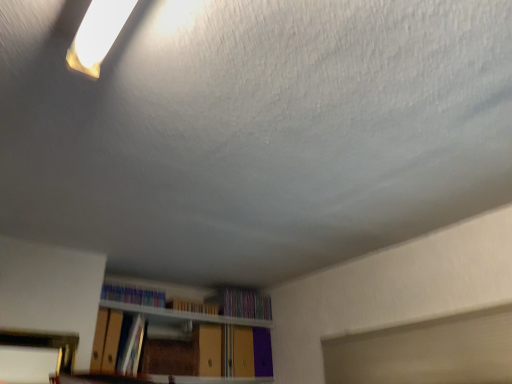
The height and width of the screenshot is (384, 512). What do you see at coordinates (192, 306) in the screenshot?
I see `hardcover book at center, the second book from the right` at bounding box center [192, 306].

In order to click on multicolored plastic books at upper center, which is the first book in left-to-right order in this screenshot , I will do tap(133, 295).

Identify the location of multicolored paper at center, which appears as the fourth book when viewed from the left. The image size is (512, 384). (242, 303).

Is point (135, 352) positioned after point (245, 303)?

No, it is in front of (245, 303).

Is hardcover book at center, which is the second book from left to right, oriented towards multicolored paper at center, marked as the 1th book in a right-to-left arrangement?

No.

How different are the orientations of hardcover book at center, which ranks as the 3th book in right-to-left order, and multicolored paper at center, which appears as the fourth book when viewed from the left, in degrees?

hardcover book at center, which ranks as the 3th book in right-to-left order, and multicolored paper at center, which appears as the fourth book when viewed from the left, are facing 0.0986 degrees away from each other.

Which object is wider, hardcover book at center, which is the second book from left to right, or multicolored paper at center, which appears as the fourth book when viewed from the left?

multicolored paper at center, which appears as the fourth book when viewed from the left.

Would you say multicolored plastic books at upper center, which is the first book in left-to-right order, is part of multicolored paper at center, marked as the 1th book in a right-to-left arrangement,'s contents?

No, multicolored plastic books at upper center, which is the first book in left-to-right order, is located outside of multicolored paper at center, marked as the 1th book in a right-to-left arrangement.

Visually, is multicolored paper at center, marked as the 1th book in a right-to-left arrangement, positioned to the left or to the right of multicolored plastic books at upper center, which is the first book in left-to-right order?

multicolored paper at center, marked as the 1th book in a right-to-left arrangement, is positioned on multicolored plastic books at upper center, which is the first book in left-to-right order,'s right side.

From the picture: Between multicolored paper at center, marked as the 1th book in a right-to-left arrangement, and multicolored plastic books at upper center, which is the first book in left-to-right order, which one has more height?

With more height is multicolored paper at center, marked as the 1th book in a right-to-left arrangement.

Locate an element on the screen. This screenshot has height=384, width=512. the 2nd book behind the multicolored plastic books at upper center, which appears as the fourth book when viewed from the right, counting from the anchor's position is located at coordinates (242, 303).

Which of these two, multicolored paper at center, marked as the 1th book in a right-to-left arrangement, or hardcover book at center, the second book from the right, is smaller?

With smaller size is hardcover book at center, the second book from the right.

Is multicolored paper at center, which appears as the fourth book when viewed from the left, facing away from hardcover book at center, which is the 3th book from left to right?

No.

Can you tell me how much multicolored paper at center, marked as the 1th book in a right-to-left arrangement, and hardcover book at center, which is the 3th book from left to right, differ in facing direction?

The facing directions of multicolored paper at center, marked as the 1th book in a right-to-left arrangement, and hardcover book at center, which is the 3th book from left to right, are 0.63 degrees apart.

Considering the relative sizes of multicolored paper at center, marked as the 1th book in a right-to-left arrangement, and hardcover book at center, which is the 3th book from left to right, in the image provided, is multicolored paper at center, marked as the 1th book in a right-to-left arrangement, wider than hardcover book at center, which is the 3th book from left to right,?

Yes.

Is hardcover book at center, which ranks as the 3th book in right-to-left order, far from multicolored plastic books at upper center, which is the first book in left-to-right order?

hardcover book at center, which ranks as the 3th book in right-to-left order, is actually quite close to multicolored plastic books at upper center, which is the first book in left-to-right order.

Can you tell me how much hardcover book at center, which is the second book from left to right, and multicolored plastic books at upper center, which appears as the fourth book when viewed from the right, differ in facing direction?

hardcover book at center, which is the second book from left to right, and multicolored plastic books at upper center, which appears as the fourth book when viewed from the right, are facing 4.84 degrees away from each other.

Which is more to the left, hardcover book at center, which ranks as the 3th book in right-to-left order, or multicolored plastic books at upper center, which appears as the fourth book when viewed from the right?

multicolored plastic books at upper center, which appears as the fourth book when viewed from the right, is more to the left.

From the image's perspective, relative to multicolored plastic books at upper center, which appears as the fourth book when viewed from the right, is hardcover book at center, which is the second book from left to right, above or below?

From the image's perspective, hardcover book at center, which is the second book from left to right, appears below multicolored plastic books at upper center, which appears as the fourth book when viewed from the right.

From a real-world perspective, relative to hardcover book at center, which is the second book from left to right, is hardcover book at center, the second book from the right, vertically above or below?

Clearly, from a real-world perspective, hardcover book at center, the second book from the right, is above hardcover book at center, which is the second book from left to right.

Considering the relative sizes of hardcover book at center, the second book from the right, and hardcover book at center, which is the second book from left to right, in the image provided, is hardcover book at center, the second book from the right, thinner than hardcover book at center, which is the second book from left to right,?

Yes, hardcover book at center, the second book from the right, is thinner than hardcover book at center, which is the second book from left to right.

Does hardcover book at center, which is the 3th book from left to right, have a smaller size compared to hardcover book at center, which is the second book from left to right?

Yes, hardcover book at center, which is the 3th book from left to right, is smaller than hardcover book at center, which is the second book from left to right.

Relative to hardcover book at center, which is the second book from left to right, is hardcover book at center, which is the 3th book from left to right, in front or behind?

In the image, hardcover book at center, which is the 3th book from left to right, appears behind hardcover book at center, which is the second book from left to right.

Between multicolored paper at center, which appears as the fourth book when viewed from the left, and hardcover book at center, which ranks as the 3th book in right-to-left order, which one appears on the right side from the viewer's perspective?

Positioned to the right is multicolored paper at center, which appears as the fourth book when viewed from the left.

Is multicolored paper at center, marked as the 1th book in a right-to-left arrangement, beside hardcover book at center, which ranks as the 3th book in right-to-left order?

There is a gap between multicolored paper at center, marked as the 1th book in a right-to-left arrangement, and hardcover book at center, which ranks as the 3th book in right-to-left order.

Is multicolored paper at center, marked as the 1th book in a right-to-left arrangement, closer to the viewer compared to hardcover book at center, which is the second book from left to right?

No, it is not.

How different are the orientations of multicolored plastic books at upper center, which appears as the fourth book when viewed from the right, and hardcover book at center, which ranks as the 3th book in right-to-left order, in degrees?

The angle between the facing direction of multicolored plastic books at upper center, which appears as the fourth book when viewed from the right, and the facing direction of hardcover book at center, which ranks as the 3th book in right-to-left order, is 4.84 degrees.

Are multicolored plastic books at upper center, which appears as the fourth book when viewed from the right, and hardcover book at center, which is the second book from left to right, far apart?

That's not correct — multicolored plastic books at upper center, which appears as the fourth book when viewed from the right, is a little close to hardcover book at center, which is the second book from left to right.

Can hardcover book at center, which is the second book from left to right, be found inside multicolored plastic books at upper center, which appears as the fourth book when viewed from the right?

No.

I want to click on the 3rd book above when counting from the hardcover book at center, which is the second book from left to right (from the image's perspective), so click(133, 295).

You are a GUI agent. You are given a task and a screenshot of the screen. Output one action in this format:
    pyautogui.click(x=<x>, y=<y>)
    Task: Click on the 3rd book in front when counting from the multicolored paper at center, marked as the 1th book in a right-to-left arrangement
    The image size is (512, 384).
    Given the screenshot: What is the action you would take?
    pyautogui.click(x=131, y=347)

Image resolution: width=512 pixels, height=384 pixels. I want to click on book positioned vertically above the multicolored plastic books at upper center, which is the first book in left-to-right order (from a real-world perspective), so click(x=242, y=303).

Based on their spatial positions, is multicolored plastic books at upper center, which appears as the fourth book when viewed from the right, or hardcover book at center, which is the 3th book from left to right, closer to multicolored paper at center, which appears as the fourth book when viewed from the left?

hardcover book at center, which is the 3th book from left to right, lies closer to multicolored paper at center, which appears as the fourth book when viewed from the left, than the other object.

When comparing their distances from multicolored plastic books at upper center, which is the first book in left-to-right order, does hardcover book at center, which is the second book from left to right, or hardcover book at center, which is the 3th book from left to right, seem closer?

The object closer to multicolored plastic books at upper center, which is the first book in left-to-right order, is hardcover book at center, which is the second book from left to right.

Estimate the real-world distances between objects in this image. Which object is further from hardcover book at center, which ranks as the 3th book in right-to-left order, multicolored plastic books at upper center, which appears as the fourth book when viewed from the right, or multicolored paper at center, marked as the 1th book in a right-to-left arrangement?

multicolored paper at center, marked as the 1th book in a right-to-left arrangement.

Estimate the real-world distances between objects in this image. Which object is closer to hardcover book at center, which is the second book from left to right, multicolored paper at center, marked as the 1th book in a right-to-left arrangement, or hardcover book at center, which is the 3th book from left to right?

hardcover book at center, which is the 3th book from left to right.

Estimate the real-world distances between objects in this image. Which object is further from multicolored plastic books at upper center, which is the first book in left-to-right order, hardcover book at center, which is the 3th book from left to right, or hardcover book at center, which is the second book from left to right?

The object further to multicolored plastic books at upper center, which is the first book in left-to-right order, is hardcover book at center, which is the 3th book from left to right.

Based on their spatial positions, is multicolored plastic books at upper center, which is the first book in left-to-right order, or hardcover book at center, the second book from the right, further from hardcover book at center, which ranks as the 3th book in right-to-left order?

hardcover book at center, the second book from the right.

Considering their positions, is multicolored paper at center, marked as the 1th book in a right-to-left arrangement, positioned closer to multicolored plastic books at upper center, which is the first book in left-to-right order, than hardcover book at center, which ranks as the 3th book in right-to-left order?

hardcover book at center, which ranks as the 3th book in right-to-left order, lies closer to multicolored plastic books at upper center, which is the first book in left-to-right order, than the other object.

Looking at the image, which one is located closer to hardcover book at center, which is the 3th book from left to right, multicolored paper at center, which appears as the fourth book when viewed from the left, or multicolored plastic books at upper center, which is the first book in left-to-right order?

Among the two, multicolored paper at center, which appears as the fourth book when viewed from the left, is located nearer to hardcover book at center, which is the 3th book from left to right.

Find the location of a particular element. This screenshot has width=512, height=384. book located between multicolored plastic books at upper center, which appears as the fourth book when viewed from the right, and hardcover book at center, which is the 3th book from left to right, in the left-right direction is located at coordinates (131, 347).

Where is `book between hardcover book at center, which is the second book from left to right, and multicolored paper at center, which appears as the fourth book when viewed from the left, in the horizontal direction`? This screenshot has height=384, width=512. book between hardcover book at center, which is the second book from left to right, and multicolored paper at center, which appears as the fourth book when viewed from the left, in the horizontal direction is located at coordinates (192, 306).